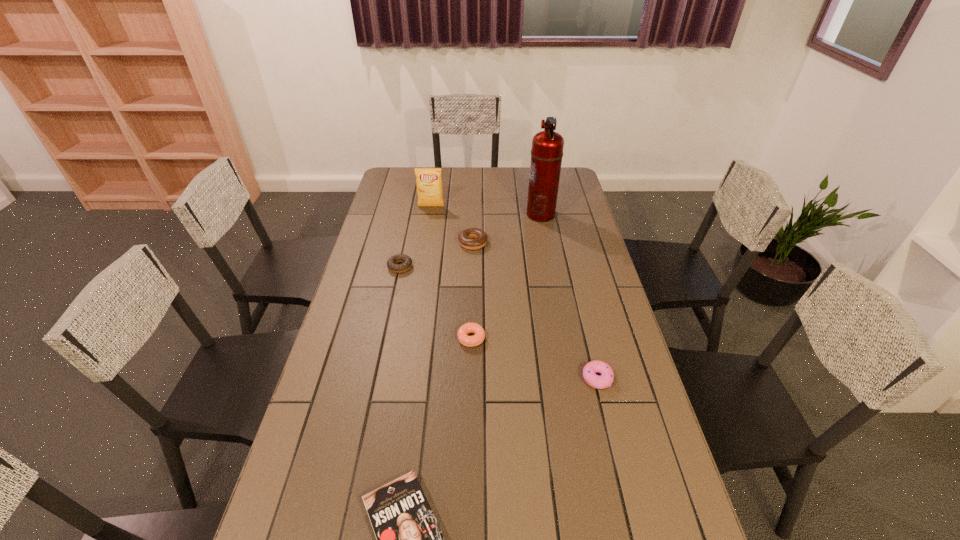
This screenshot has width=960, height=540. I want to click on the tallest object, so click(547, 146).

I want to click on crisp (potato chip), so click(x=429, y=180).

I want to click on the farthest doughnut, so click(x=473, y=238).

This screenshot has height=540, width=960. I want to click on the sixth farthest object, so click(x=605, y=380).

Where is `the rightmost doughnut`? The height and width of the screenshot is (540, 960). the rightmost doughnut is located at coordinates (605, 380).

Find the location of a particular element. The image size is (960, 540). the second nearest doughnut is located at coordinates (470, 341).

You are a GUI agent. You are given a task and a screenshot of the screen. Output one action in this format:
    pyautogui.click(x=<x>, y=<y>)
    Task: Click on the leftmost doughnut
    
    Given the screenshot: What is the action you would take?
    pyautogui.click(x=392, y=265)

The image size is (960, 540). I want to click on the fourth nearest object, so click(x=392, y=265).

You are a GUI agent. You are given a task and a screenshot of the screen. Output one action in this format:
    pyautogui.click(x=<x>, y=<y>)
    Task: Click on the free spot located on the nozzle side of the fire extinguisher
    The width and height of the screenshot is (960, 540).
    Given the screenshot: What is the action you would take?
    pyautogui.click(x=503, y=214)

Identify the location of free space located 0.300m on the nozzle side of the fire extinguisher. (456, 214).